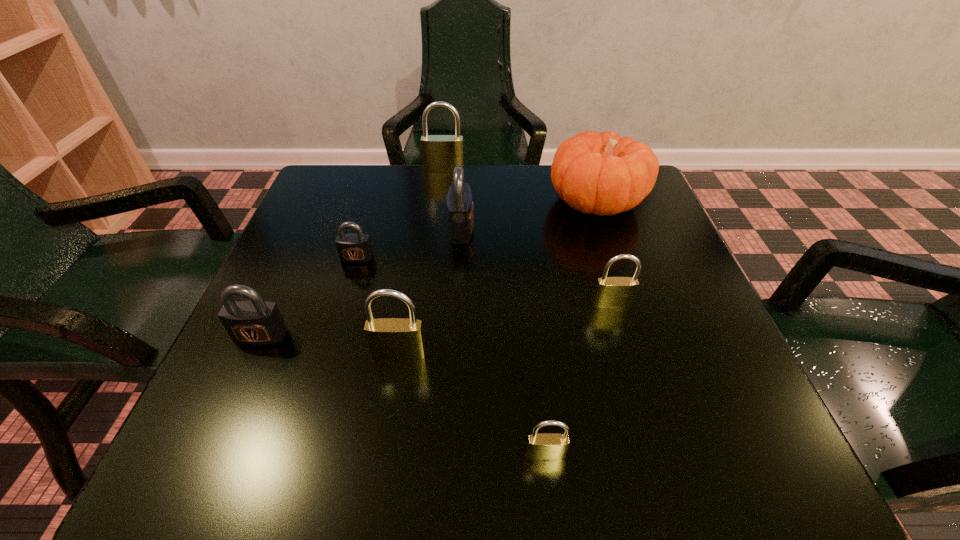
This screenshot has width=960, height=540. Identify the location of vacant region located on the front-facing side of the rightmost brass padlock. (642, 408).

This screenshot has width=960, height=540. I want to click on vacant space situated 0.240m on the front of the second padlock from left to right near the keyhole, so [325, 362].

Where is `pumpkin that is at the far edge`? The image size is (960, 540). pumpkin that is at the far edge is located at coordinates 596,173.

Find the location of a particular element. This screenshot has height=540, width=960. object positioned at the near edge is located at coordinates (546, 446).

The width and height of the screenshot is (960, 540). In order to click on pumpkin present at the right edge in this screenshot , I will do `click(596, 173)`.

You are a GUI agent. You are given a task and a screenshot of the screen. Output one action in this format:
    pyautogui.click(x=<x>, y=<y>)
    Task: Click on the padlock present at the right edge
    The width and height of the screenshot is (960, 540).
    Given the screenshot: What is the action you would take?
    pyautogui.click(x=611, y=292)

You are a GUI agent. You are given a task and a screenshot of the screen. Output one action in this format:
    pyautogui.click(x=<x>, y=<y>)
    Task: Click on the object located at the far right corner
    
    Given the screenshot: What is the action you would take?
    pyautogui.click(x=596, y=173)

Identify the location of free space at the far edge. 446,205.

The width and height of the screenshot is (960, 540). Identify the location of vacant space at the near edge of the desktop. (465, 431).

In the image, there is a desktop. At what (x,y) coordinates should I click in order to perform the action: click on free space at the left edge. Please return your answer as a coordinate pair (x, y). Image resolution: width=960 pixels, height=540 pixels. Looking at the image, I should click on (337, 283).